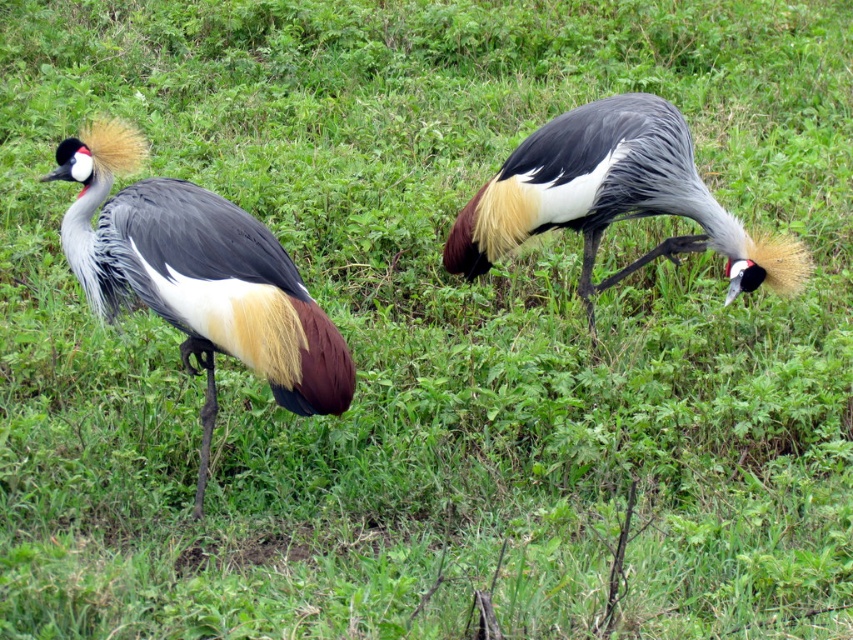
Is matte gray and white bird at left shorter than matte gray crane at center?

No, matte gray and white bird at left is not shorter than matte gray crane at center.

How much distance is there between matte gray and white bird at left and matte gray crane at center?

matte gray and white bird at left is 1.46 meters from matte gray crane at center.

Between point (315, 326) and point (604, 205), which one is positioned in front?

Point (315, 326) is more forward.

This screenshot has height=640, width=853. I want to click on matte gray and white bird at left, so click(x=196, y=276).